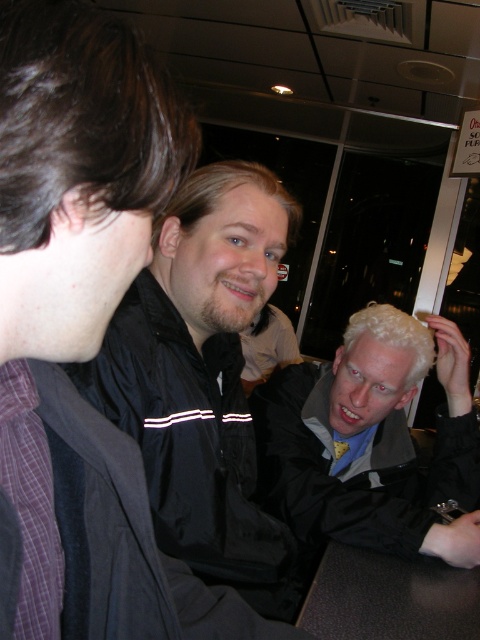
Is black matte jacket at center in front of light brown hair at center?

That is True.

At what (x,y) coordinates should I click in order to perform the action: click on black matte jacket at center. Please return your answer as a coordinate pair (x, y). The width and height of the screenshot is (480, 640). Looking at the image, I should click on (204, 378).

From the picture: Between light brown hair at center and brown leather table at lower center, which one has more height?

light brown hair at center is taller.

Which is below, light brown hair at center or brown leather table at lower center?

brown leather table at lower center is lower down.

Find the location of a particular element. The width and height of the screenshot is (480, 640). light brown hair at center is located at coordinates (372, 440).

Does black matte jacket at center have a greater width compared to brown leather table at lower center?

In fact, black matte jacket at center might be narrower than brown leather table at lower center.

Measure the distance between point (167, 378) and camera.

Point (167, 378) and camera are 36.84 inches apart.

Between point (240, 380) and point (451, 595), which one is positioned in front?

Point (451, 595)

This screenshot has width=480, height=640. In order to click on black matte jacket at center in this screenshot , I will do `click(204, 378)`.